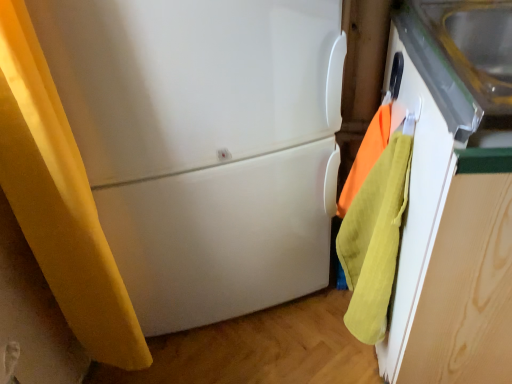
Question: From a real-world perspective, is orange cotton towel at right positioned above or below white matte refrigerator at center?

Choices:
 (A) above
 (B) below

Answer: (A)

Question: From the image's perspective, relative to white matte refrigerator at center, is orange cotton towel at right above or below?

Choices:
 (A) above
 (B) below

Answer: (B)

Question: Would you say orange cotton towel at right is to the left or to the right of white matte refrigerator at center in the picture?

Choices:
 (A) right
 (B) left

Answer: (A)

Question: Is white matte refrigerator at center in front of or behind orange cotton towel at right in the image?

Choices:
 (A) front
 (B) behind

Answer: (A)

Question: Is white matte refrigerator at center taller or shorter than orange cotton towel at right?

Choices:
 (A) tall
 (B) short

Answer: (A)

Question: Is white matte refrigerator at center wider or thinner than orange cotton towel at right?

Choices:
 (A) wide
 (B) thin

Answer: (A)

Question: From the image's perspective, is white matte refrigerator at center positioned above or below orange cotton towel at right?

Choices:
 (A) below
 (B) above

Answer: (B)